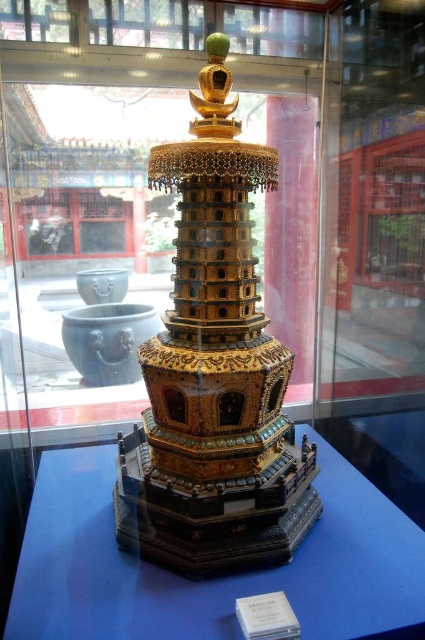
Question: Does gold/gilded wood tower at center have a smaller size compared to transparent glass table at center?

Choices:
 (A) no
 (B) yes

Answer: (A)

Question: Can you confirm if gold/gilded wood tower at center is wider than transparent glass table at center?

Choices:
 (A) no
 (B) yes

Answer: (A)

Question: Which point is closer to the camera taking this photo?

Choices:
 (A) (263, 396)
 (B) (337, 637)

Answer: (B)

Question: Which point appears closest to the camera in this image?

Choices:
 (A) (204, 109)
 (B) (170, 605)

Answer: (B)

Question: Is gold/gilded wood tower at center smaller than transparent glass table at center?

Choices:
 (A) yes
 (B) no

Answer: (B)